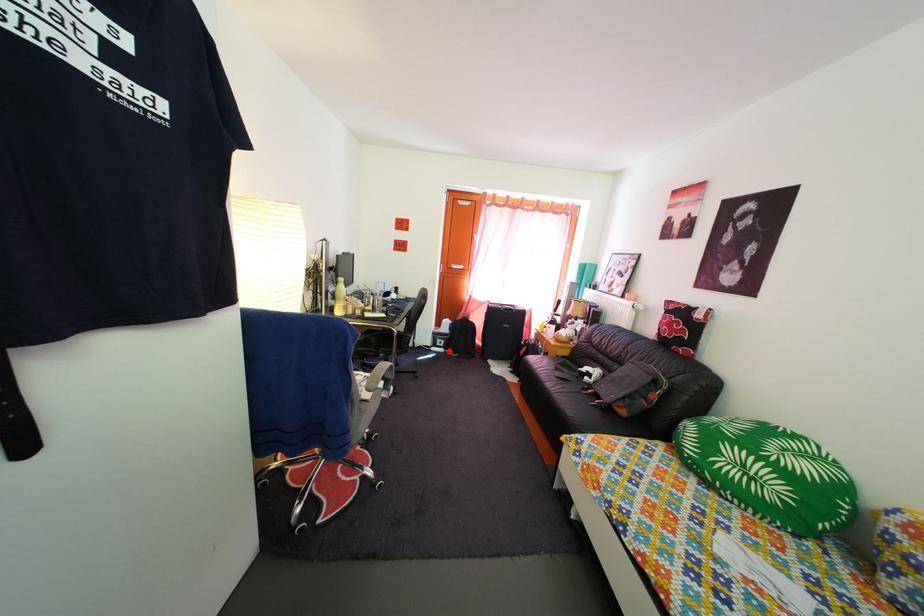
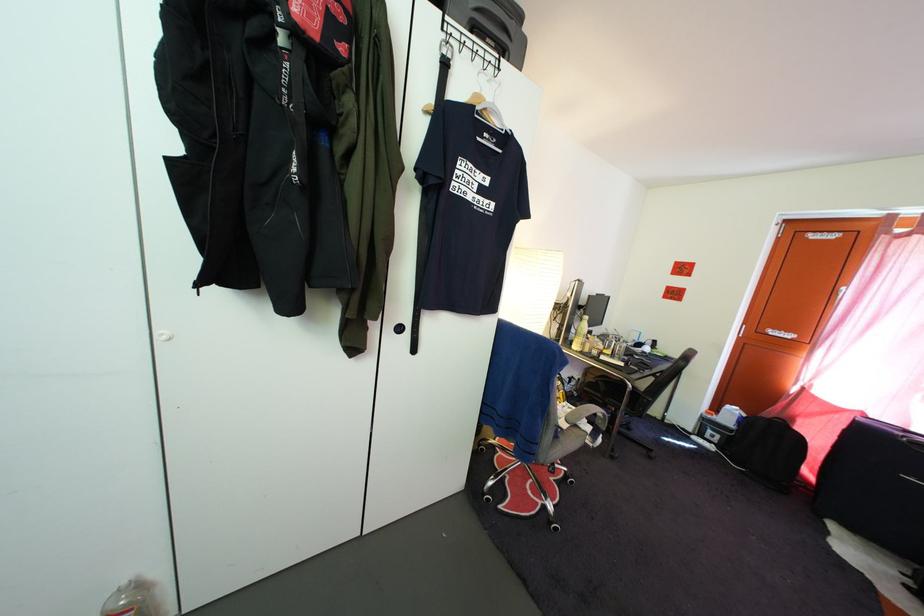
The point at the highlighted location is marked in the first image. Where is the corresponding point in the second image?

(721, 445)